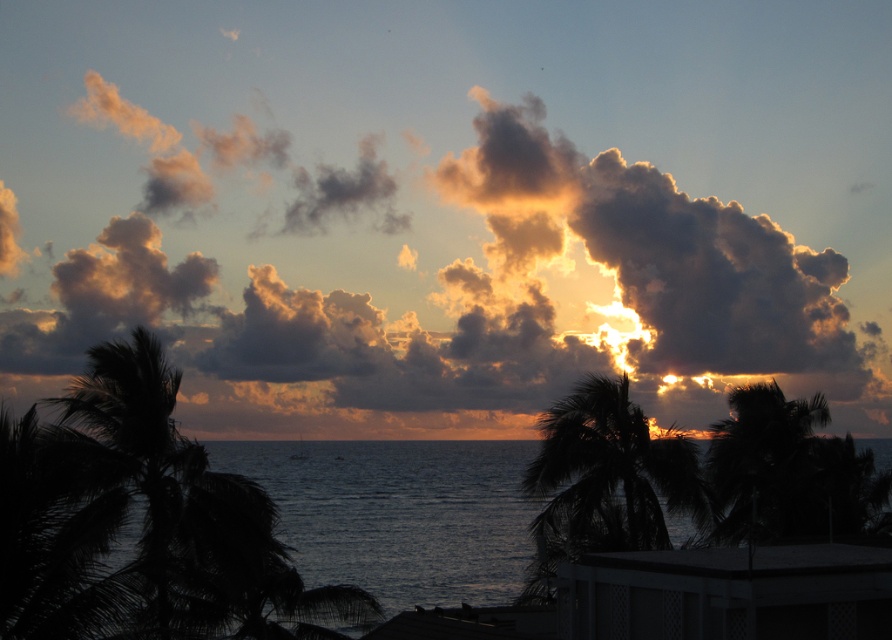
Question: Can you confirm if golden cotton clouds at upper center is thinner than dark blue water at center?

Choices:
 (A) no
 (B) yes

Answer: (A)

Question: Which of the following is the farthest from the observer?

Choices:
 (A) silhouette leafy palm at center
 (B) dark blue water at center
 (C) golden cotton clouds at upper center
 (D) dark green leafy palm tree at right

Answer: (C)

Question: In this image, where is silhouette leafy palm at center located relative to dark green leafy palm tree at right?

Choices:
 (A) left
 (B) right

Answer: (A)

Question: Which of these objects is positioned farthest from the dark green leafy palm tree at right?

Choices:
 (A) golden cotton clouds at upper center
 (B) white lattice balcony at lower right

Answer: (A)

Question: Which object is positioned closest to the golden cotton clouds at upper center?

Choices:
 (A) dark blue water at center
 (B) dark green leafy palm tree at right

Answer: (A)

Question: Is dark blue water at center below white lattice balcony at lower right?

Choices:
 (A) no
 (B) yes

Answer: (B)